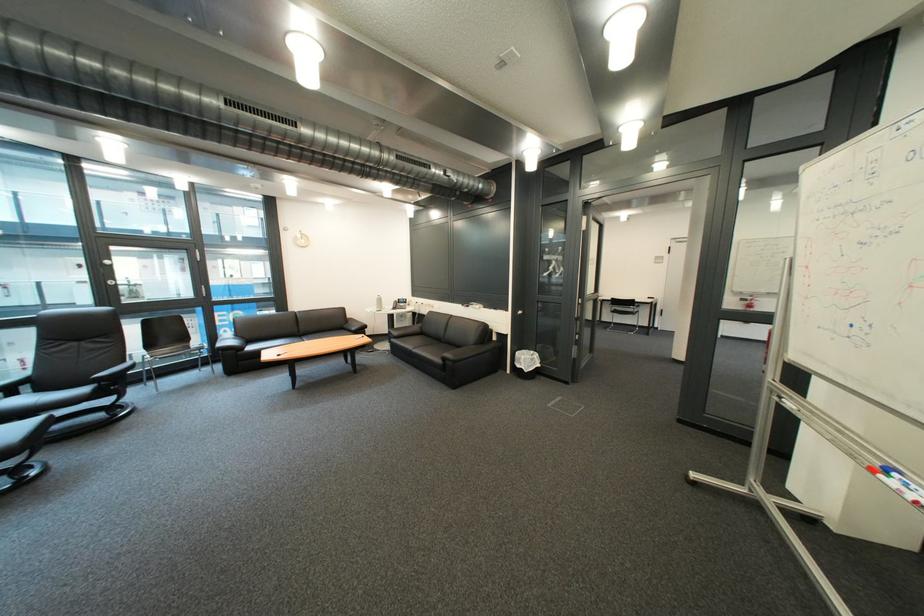
You are a GUI agent. You are given a task and a screenshot of the screen. Output one action in this format:
    pyautogui.click(x=<x>, y=<y>)
    Task: Click on the sofa sitting surface
    Image resolution: width=924 pixels, height=616 pixels.
    Given the screenshot: What is the action you would take?
    pyautogui.click(x=292, y=339)